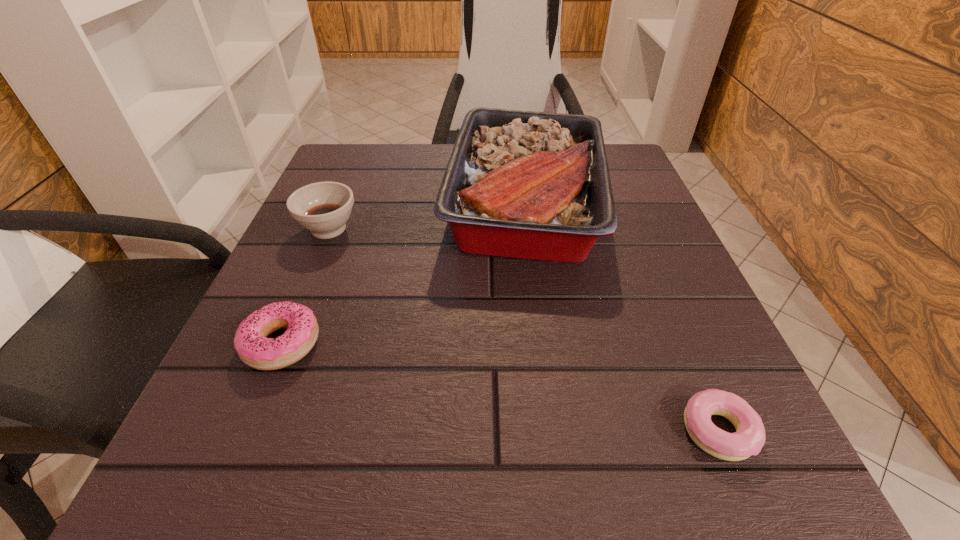
Where is `tray`? tray is located at coordinates (533, 185).

Locate an element on the screen. the third shortest object is located at coordinates (323, 208).

Identify the location of the farther doughnut. This screenshot has width=960, height=540. (253, 347).

You are a GUI agent. You are given a task and a screenshot of the screen. Output one action in this format:
    pyautogui.click(x=<x>, y=<y>)
    Task: Click on the second shortest object
    
    Given the screenshot: What is the action you would take?
    pyautogui.click(x=253, y=347)

What are the coordinates of `the nearer doughnut` in the screenshot? It's located at [749, 438].

Identify the location of the nearest object. This screenshot has height=540, width=960. (749, 438).

Locate an element on the screen. This screenshot has height=540, width=960. blank space located on the front of the tray is located at coordinates (563, 478).

The height and width of the screenshot is (540, 960). I want to click on free region located on the right of the soup bowl, so click(x=530, y=229).

Identify the location of free region located 0.100m on the right of the left doughnut. Image resolution: width=960 pixels, height=540 pixels. (391, 343).

The image size is (960, 540). I want to click on vacant space located 0.200m on the back of the nearest object, so click(x=659, y=290).